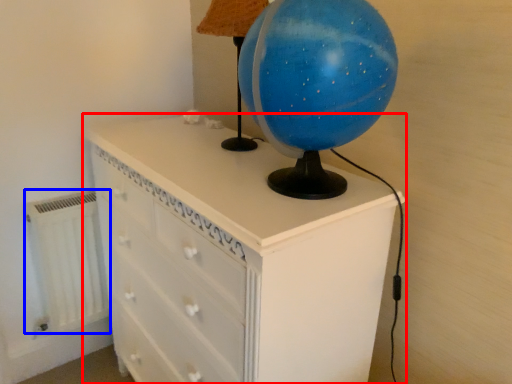
Question: Which of the following is the farthest to the observer, chest of drawers (highlighted by a red box) or radiator (highlighted by a blue box)?

Choices:
 (A) chest of drawers
 (B) radiator

Answer: (B)